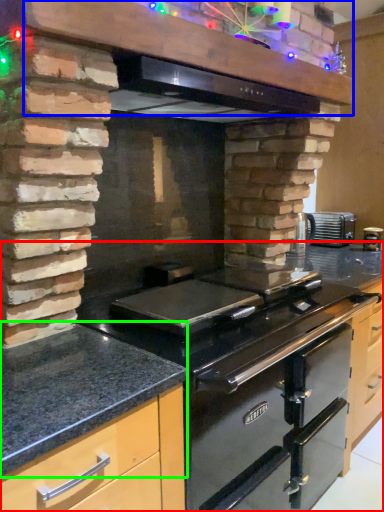
Question: Which object is positioned closest to countertop (highlighted by a red box)? Select from vent (highlighted by a blue box) and countertop (highlighted by a green box).

Choices:
 (A) vent
 (B) countertop

Answer: (B)